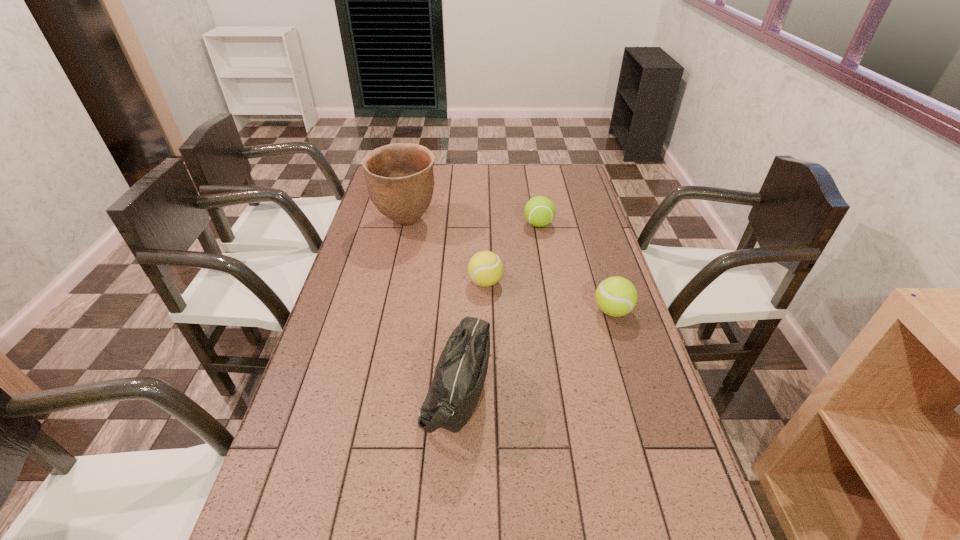
In the image, there is a desktop. Find the location of `vacant space at the far right corner`. vacant space at the far right corner is located at coordinates (554, 184).

Image resolution: width=960 pixels, height=540 pixels. I want to click on vacant area between the leftmost object and the rightmost object, so click(x=509, y=267).

Image resolution: width=960 pixels, height=540 pixels. Identify the location of vacant area that lies between the leftmost object and the fourth object from left to right. (472, 224).

The height and width of the screenshot is (540, 960). What are the coordinates of `vacant area that lies between the second nearest tennis ball and the second object from right to left` in the screenshot? It's located at (512, 253).

Locate an element on the screen. vacant area that lies between the second tennis ball from right to left and the shoulder bag is located at coordinates (497, 307).

Image resolution: width=960 pixels, height=540 pixels. What are the coordinates of `unoccupied area between the third nearest object and the nearest tennis ball` in the screenshot? It's located at (549, 296).

The width and height of the screenshot is (960, 540). I want to click on vacant space in between the nearest object and the rightmost object, so click(535, 350).

Choose which object is the third nearest neighbor to the leftmost object. Please provide its 2D coordinates. Your answer should be formatted as a tuple, i.e. [(x, y)], where the tuple contains the x and y coordinates of a point satisfying the conditions above.

[(460, 373)]

Identify which object is located as the second nearest to the fourth farthest object. Please provide its 2D coordinates. Your answer should be formatted as a tuple, i.e. [(x, y)], where the tuple contains the x and y coordinates of a point satisfying the conditions above.

[(460, 373)]

Locate an element on the screen. Image resolution: width=960 pixels, height=540 pixels. tennis ball that is the closest to the fourth shortest object is located at coordinates (485, 268).